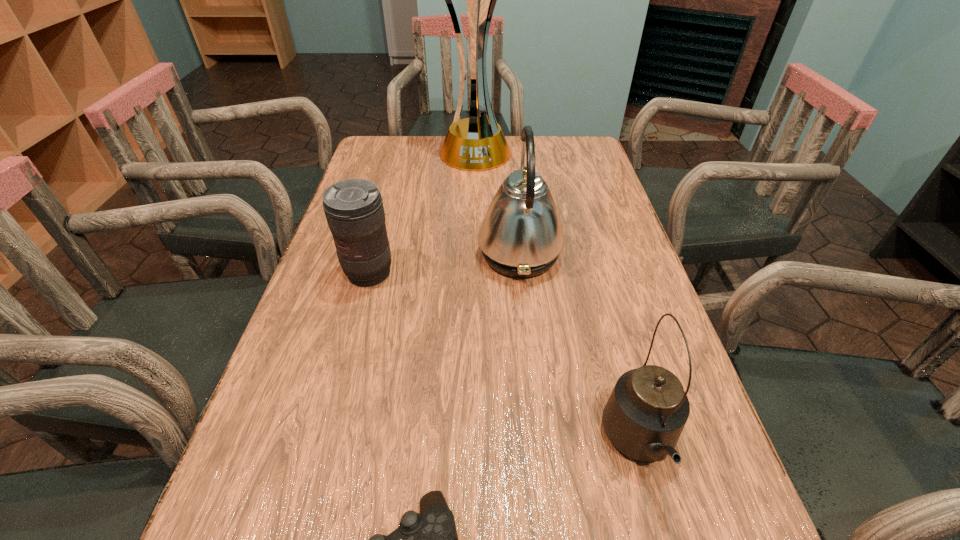
The height and width of the screenshot is (540, 960). I want to click on the farthest object, so click(476, 143).

Locate an element on the screen. The width and height of the screenshot is (960, 540). trophy is located at coordinates (476, 143).

This screenshot has width=960, height=540. I want to click on the fourth shortest object, so click(521, 235).

Find the location of a particular element. The width and height of the screenshot is (960, 540). the farther kettle is located at coordinates (521, 235).

I want to click on the rightmost object, so click(648, 408).

Identify the location of the right kettle. This screenshot has height=540, width=960. (648, 408).

Locate an element on the screen. The width and height of the screenshot is (960, 540). telephoto lens is located at coordinates (354, 210).

The width and height of the screenshot is (960, 540). I want to click on the leftmost object, so pos(354,210).

You are a GUI agent. You are given a task and a screenshot of the screen. Output one action in this format:
    pyautogui.click(x=<x>, y=<y>)
    Task: Click on the vacant space located 0.150m on the front-facing side of the farthest object
    
    Given the screenshot: What is the action you would take?
    pyautogui.click(x=473, y=198)

Where is `vacant space situated 0.280m from the spout of the taller kettle`? vacant space situated 0.280m from the spout of the taller kettle is located at coordinates (362, 254).